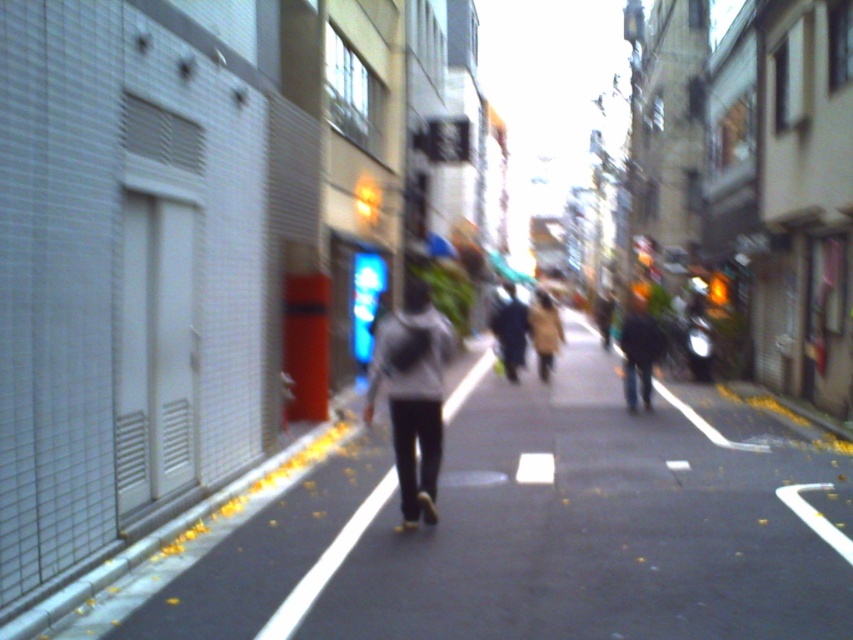
You are a delivery person carrying a large package and need to navigate between the light gray sweater at center and the dark gray sweater at center. Given that your package is 1 meter wide, can you pass through the space between them without touching either?

The distance between the light gray sweater at center and dark gray sweater at center is 8.51 meters, which is significantly wider than your 1 meter wide package. Therefore, you can easily pass through the space between them without any issues.

You are standing on the sidewalk and see two sweaters hanging on a clothesline between two poles. The sweaters are the light gray sweater at center and the dark gray sweater at center. Which sweater is closer to the left pole?

The light gray sweater at center is closer to the left pole because it is positioned on the left side of the dark gray sweater at center.